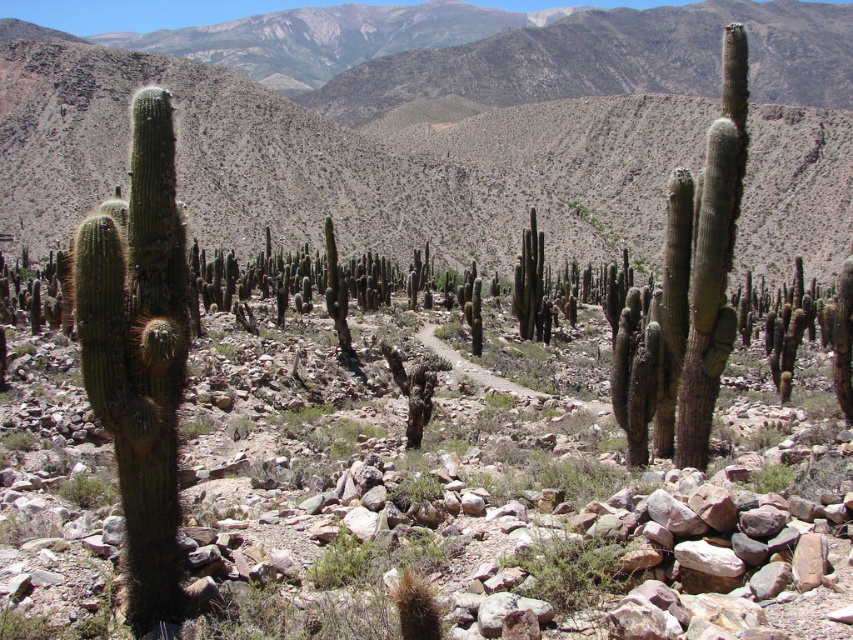
You are standing in the desert and want to reach the green textured mountain range at upper center. If your average walking speed is 3 miles per hour, how long would it take you to reach the mountain range?

The distance to the green textured mountain range at upper center is 46.39 feet. Since 3 miles per hour equals approximately 4.4 feet per second, dividing 46.39 by 4.4 gives roughly 10.54 seconds. Therefore, it would take about 10.5 seconds to reach the mountain range.

You are a hiker planning to take the dirt path through the desert. You see the green textured mountain range at upper center and the green spiny cactus at left. Which object is positioned higher in the image?

The green textured mountain range at upper center is located above the green spiny cactus at left in the image.